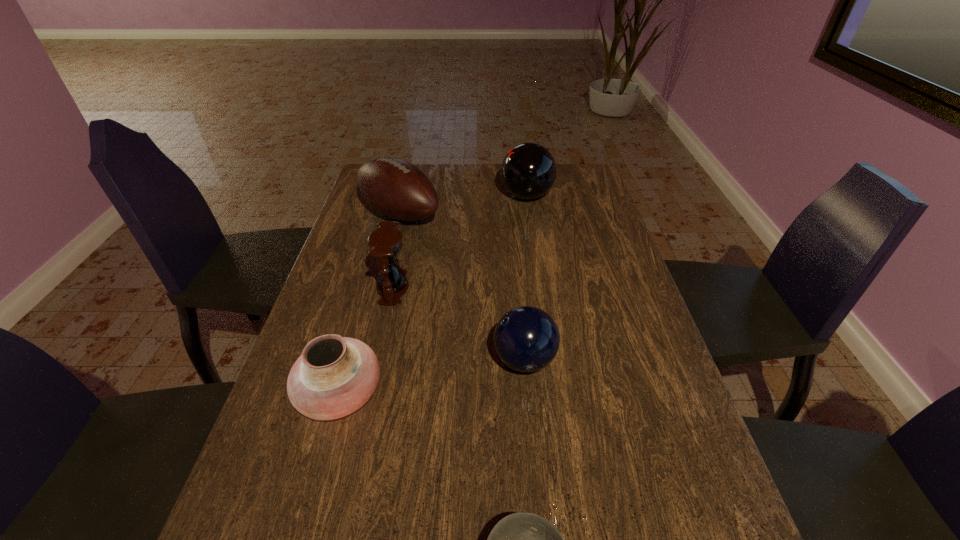
In the image, there is a desktop. What are the coordinates of `blank space at the far edge` in the screenshot? It's located at (499, 167).

Image resolution: width=960 pixels, height=540 pixels. I want to click on vacant space at the left edge, so click(x=297, y=488).

At what (x,y) coordinates should I click in order to perform the action: click on free point at the right edge. Please return your answer as a coordinate pair (x, y). Looking at the image, I should click on (557, 210).

Where is `free location at the far right corner of the desktop`? free location at the far right corner of the desktop is located at coordinates (561, 168).

Find the location of `empty space between the football (American) and the farther bowling ball`. empty space between the football (American) and the farther bowling ball is located at coordinates (464, 205).

Locate an element on the screen. The width and height of the screenshot is (960, 540). vacant area between the shorter bowling ball and the farther bowling ball is located at coordinates (525, 278).

What are the coordinates of `empty location between the shorter bowling ball and the pottery` in the screenshot? It's located at (432, 376).

Where is `vacant space that is in between the taller bowling ball and the nearer bowling ball`? vacant space that is in between the taller bowling ball and the nearer bowling ball is located at coordinates (525, 278).

This screenshot has height=540, width=960. Identify the location of free space that is in between the farther bowling ball and the football (American). (464, 205).

The image size is (960, 540). What are the coordinates of `the fifth closest object relative to the fourth nearest object` in the screenshot? It's located at (520, 539).